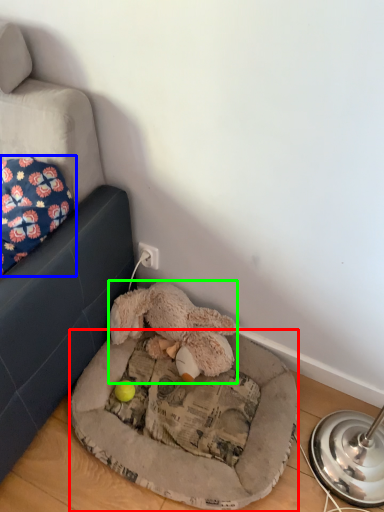
Question: Considering the real-world distances, which object is closest to dog bed (highlighted by a red box)? pillow (highlighted by a blue box) or toy (highlighted by a green box).

Choices:
 (A) pillow
 (B) toy

Answer: (B)